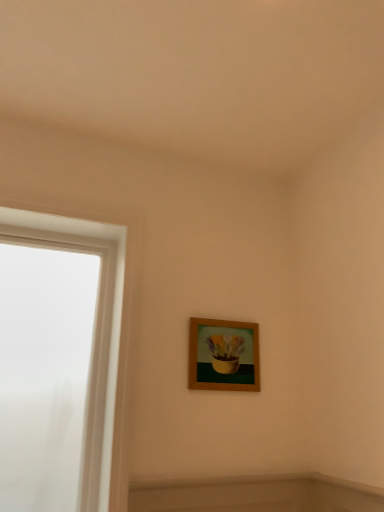
Where is `wooden frame at center`? This screenshot has width=384, height=512. wooden frame at center is located at coordinates (223, 355).

What do you see at coordinates (223, 355) in the screenshot? The image size is (384, 512). I see `wooden frame at center` at bounding box center [223, 355].

The width and height of the screenshot is (384, 512). I want to click on white frosted glass at left, so click(111, 332).

The height and width of the screenshot is (512, 384). What do you see at coordinates (111, 332) in the screenshot? I see `white frosted glass at left` at bounding box center [111, 332].

The height and width of the screenshot is (512, 384). I want to click on wooden frame at center, so click(223, 355).

Does white frosted glass at left appear on the left side of wooden frame at center?

Correct, you'll find white frosted glass at left to the left of wooden frame at center.

Is the depth of white frosted glass at left greater than that of wooden frame at center?

No, white frosted glass at left is closer to the camera.

Between point (103, 506) and point (247, 387), which one is positioned behind?

The point (247, 387) is farther.

From the picture: From the image's perspective, is white frosted glass at left under wooden frame at center?

No.

From a real-world perspective, relative to wooden frame at center, is white frosted glass at left vertically above or below?

Clearly, from a real-world perspective, white frosted glass at left is below wooden frame at center.

Does white frosted glass at left have a greater width compared to wooden frame at center?

Yes.

Can you confirm if white frosted glass at left is shorter than wooden frame at center?

No.

Does white frosted glass at left have a larger size compared to wooden frame at center?

Yes.

Is white frosted glass at left inside the boundaries of wooden frame at center, or outside?

white frosted glass at left is not inside wooden frame at center, it's outside.

Is white frosted glass at left not near wooden frame at center?

No.

Does white frosted glass at left turn towards wooden frame at center?

No, white frosted glass at left does not turn towards wooden frame at center.

What's the angular difference between white frosted glass at left and wooden frame at center's facing directions?

The facing directions of white frosted glass at left and wooden frame at center are 0.0581 degrees apart.

Locate an element on the screen. window in front of the wooden frame at center is located at coordinates (111, 332).

Is wooden frame at center at the left side of white frosted glass at left?

Incorrect, wooden frame at center is not on the left side of white frosted glass at left.

From the picture: Is the depth of wooden frame at center greater than that of white frosted glass at left?

Yes, the depth of wooden frame at center is greater than that of white frosted glass at left.

Considering the points (204, 371) and (126, 342), which point is behind, point (204, 371) or point (126, 342)?

The point (204, 371) is farther.

From the image's perspective, is wooden frame at center below white frosted glass at left?

Indeed, from the image's perspective, wooden frame at center is shown beneath white frosted glass at left.

From a real-world perspective, is wooden frame at center located higher than white frosted glass at left?

Yes, from a real-world perspective, wooden frame at center is over white frosted glass at left

Does wooden frame at center have a greater width compared to white frosted glass at left?

Incorrect, the width of wooden frame at center does not surpass that of white frosted glass at left.

Does wooden frame at center have a lesser height compared to white frosted glass at left?

Yes, wooden frame at center is shorter than white frosted glass at left.

Based on their sizes in the image, would you say wooden frame at center is bigger or smaller than white frosted glass at left?

wooden frame at center is smaller than white frosted glass at left.

Can white frosted glass at left be found inside wooden frame at center?

No, white frosted glass at left is not a part of wooden frame at center.

Is wooden frame at center with white frosted glass at left?

wooden frame at center and white frosted glass at left are clearly separated.

Is wooden frame at center turned away from white frosted glass at left?

No, white frosted glass at left is not at the back of wooden frame at center.

Where is `window on the left side of wooden frame at center`? Image resolution: width=384 pixels, height=512 pixels. window on the left side of wooden frame at center is located at coordinates (111, 332).

Identify the location of picture frame located on the right of white frosted glass at left. (223, 355).

Where is `picture frame behind the white frosted glass at left`? This screenshot has height=512, width=384. picture frame behind the white frosted glass at left is located at coordinates (223, 355).